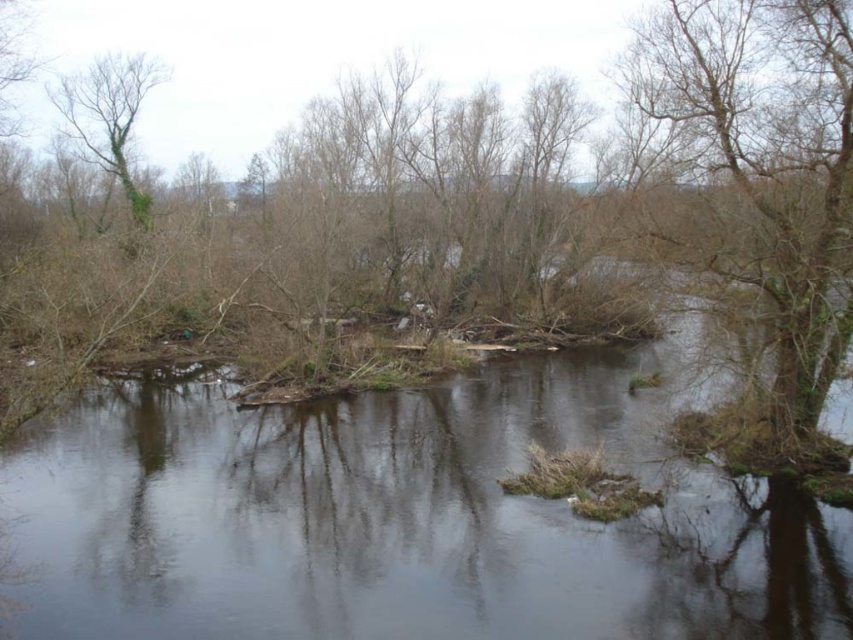
Question: Does brown wood tree at center have a smaller size compared to green leafy tree at upper left?

Choices:
 (A) no
 (B) yes

Answer: (A)

Question: Which object appears closest to the camera in this image?

Choices:
 (A) green leafy tree at upper left
 (B) brown wood tree at center
 (C) clear water at center
 (D) bare branches at right

Answer: (C)

Question: Is brown wood tree at center positioned at the back of green leafy tree at upper left?

Choices:
 (A) no
 (B) yes

Answer: (A)

Question: Which object is the closest to the brown wood tree at center?

Choices:
 (A) bare branches at right
 (B) clear water at center

Answer: (B)

Question: Does clear water at center appear on the left side of bare branches at right?

Choices:
 (A) yes
 (B) no

Answer: (A)

Question: Estimate the real-world distances between objects in this image. Which object is closer to the green leafy tree at upper left?

Choices:
 (A) bare branches at right
 (B) clear water at center
 (C) brown wood tree at center

Answer: (C)